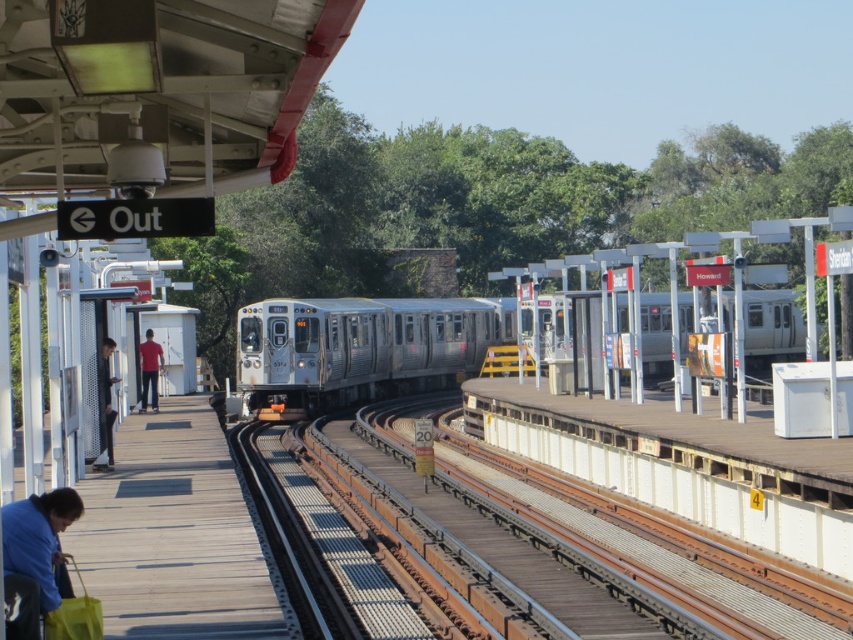
Which is above, silver metallic train at center or blue fabric bag at lower left?

silver metallic train at center

Can you confirm if silver metallic train at center is bigger than blue fabric bag at lower left?

Yes.

Find the location of `silver metallic train at center`. silver metallic train at center is located at coordinates (361, 348).

Is wooden platform at lower left bigger than matte red shirt at left?

Yes, wooden platform at lower left is bigger than matte red shirt at left.

Is point (207, 634) more distant than point (144, 355)?

That is False.

The image size is (853, 640). Identify the location of wooden platform at lower left. (173, 536).

Between matte red shirt at left and dark gray suit at left, which one has less height?

Standing shorter between the two is dark gray suit at left.

In the scene shown: Who is more forward, [151,342] or [106,436]?

Point [106,436] is more forward.

Locate an element on the screen. matte red shirt at left is located at coordinates (149, 369).